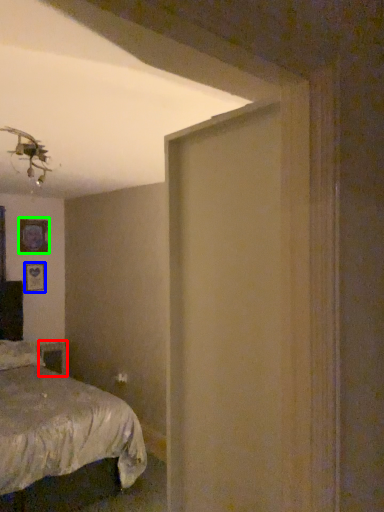
Question: Which object is positioned farthest from table (highlighted by a red box)? Select from picture frame (highlighted by a blue box) and picture frame (highlighted by a green box).

Choices:
 (A) picture frame
 (B) picture frame

Answer: (B)